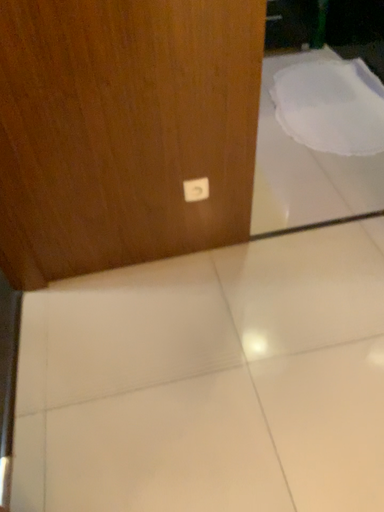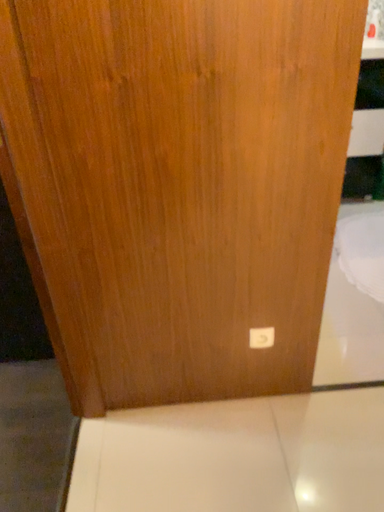
Question: How did the camera likely rotate when shooting the video?

Choices:
 (A) rotated downward
 (B) rotated upward

Answer: (B)